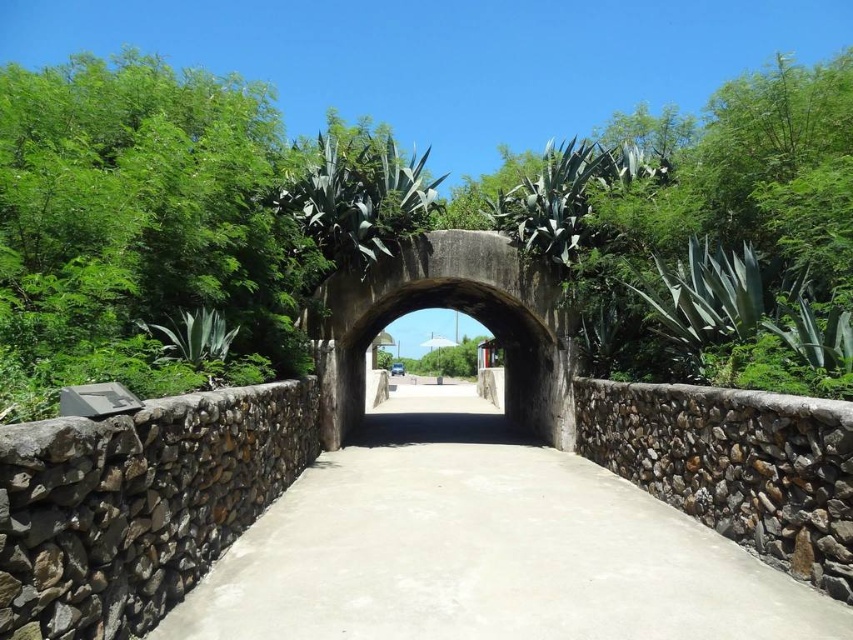
Question: Which of the following is the farthest from the observer?

Choices:
 (A) smooth concrete path at center
 (B) green leafy tree at center

Answer: (A)

Question: Does green leafy tree at center have a larger size compared to smooth concrete path at center?

Choices:
 (A) no
 (B) yes

Answer: (B)

Question: Is green leafy tree at center below smooth concrete path at center?

Choices:
 (A) no
 (B) yes

Answer: (A)

Question: Is green leafy tree at center wider than smooth concrete path at center?

Choices:
 (A) yes
 (B) no

Answer: (A)

Question: Among these objects, which one is nearest to the camera?

Choices:
 (A) green leafy tree at center
 (B) smooth concrete path at center

Answer: (A)

Question: Which point appears closest to the camera in this image?

Choices:
 (A) (433, 488)
 (B) (728, 298)

Answer: (B)